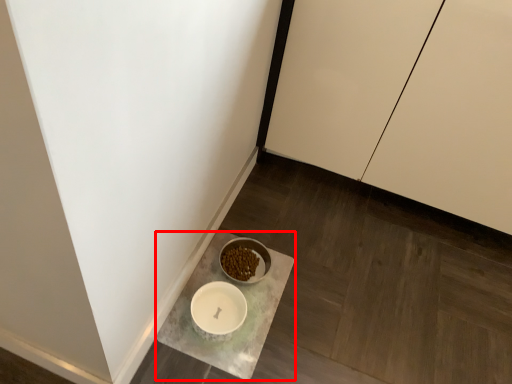
Question: In this image, where is counter (annotated by the red box) located relative to cabinetry?

Choices:
 (A) left
 (B) right

Answer: (A)